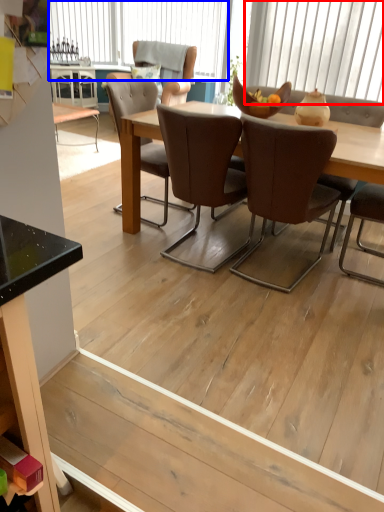
Question: Among these objects, which one is nearest to the camera, window (highlighted by a red box) or window (highlighted by a blue box)?

Choices:
 (A) window
 (B) window

Answer: (A)